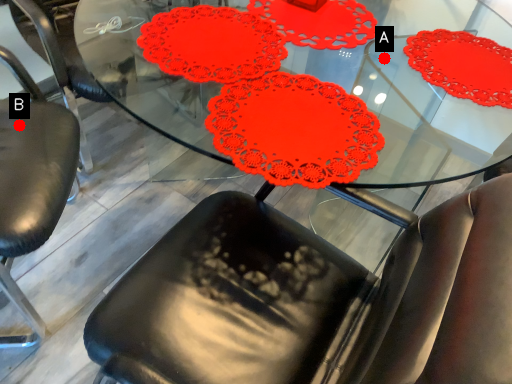
Question: Two points are circled on the image, labeled by A and B beside each circle. Which point appears farthest from the camera in this image?

Choices:
 (A) A is further
 (B) B is further

Answer: (A)